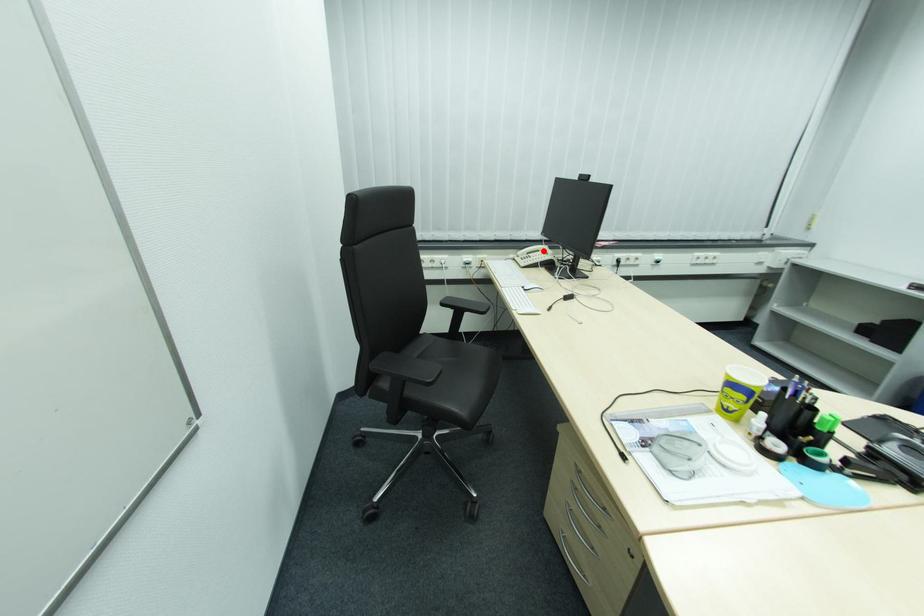
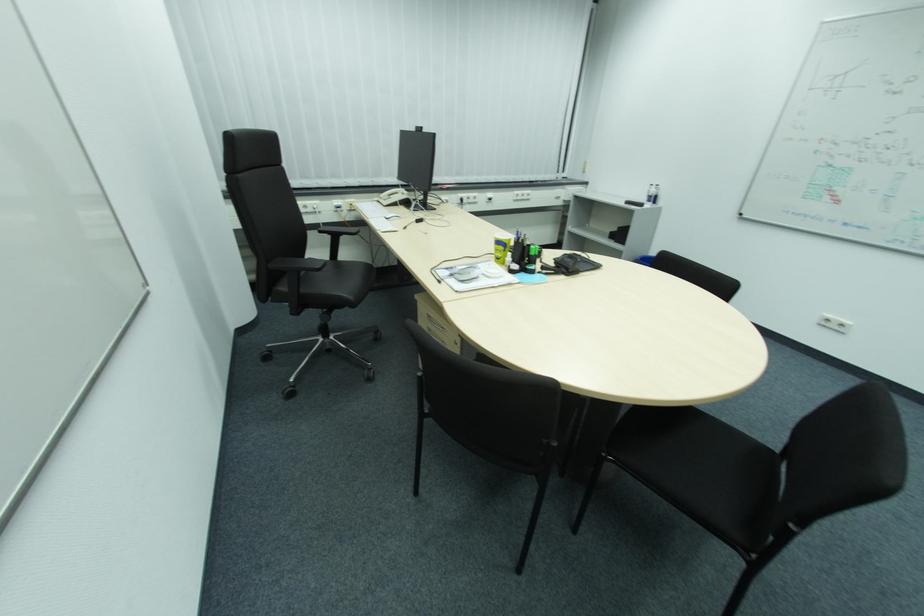
Find the pixel in the second image that matches the highlighted location in the first image.

(403, 193)